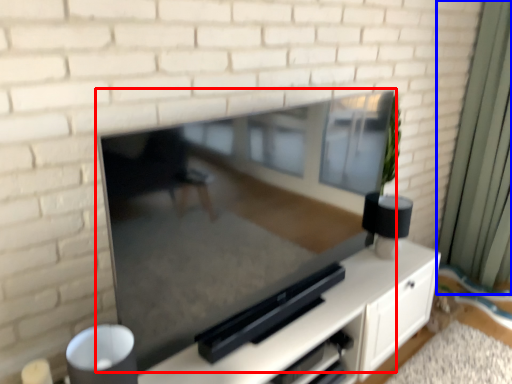
Question: Which object appears farthest to the camera in this image, fireplace (highlighted by a red box) or curtain (highlighted by a blue box)?

Choices:
 (A) fireplace
 (B) curtain

Answer: (B)